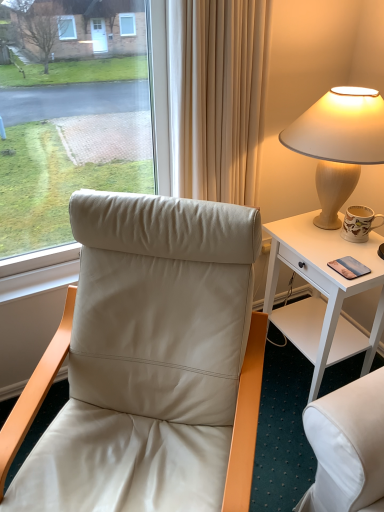
I want to click on blank space to the left of matte ceramic mug at right, so click(309, 246).